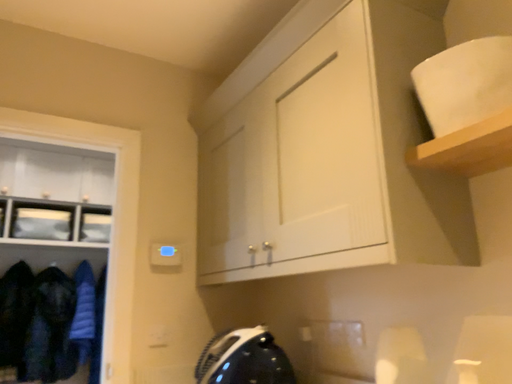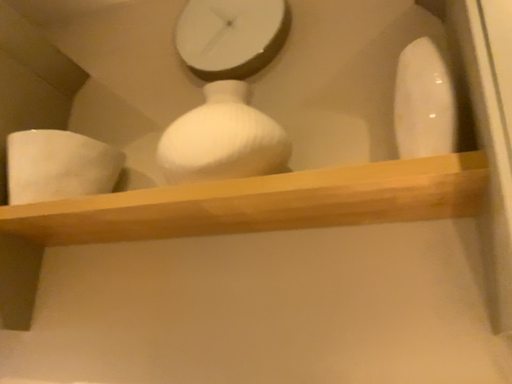
Question: How did the camera likely rotate when shooting the video?

Choices:
 (A) rotated left
 (B) rotated right

Answer: (B)